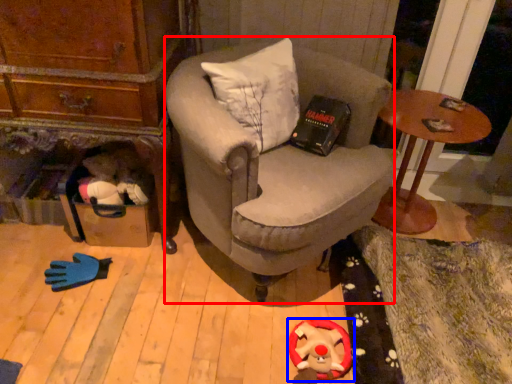
Question: Which point is closer to the camera, chair (highlighted by a red box) or toy (highlighted by a blue box)?

Choices:
 (A) chair
 (B) toy

Answer: (A)